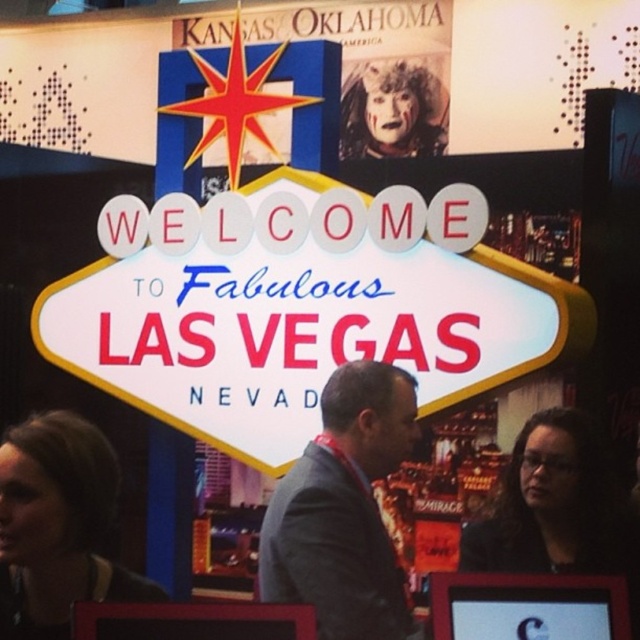
Which is behind, point (330, 531) or point (548, 540)?

The point (548, 540) is behind.

Does gray wool suit at center appear over black glossy hair at lower right?

No.

Measure the distance between point (284, 477) and camera.

The distance of point (284, 477) from camera is 37.63 meters.

Identify the location of gray wool suit at center. This screenshot has height=640, width=640. (342, 509).

In the scene shown: Is gray wool suit at center positioned before smooth black hair at lower left?

Yes.

Can you confirm if gray wool suit at center is positioned below smooth black hair at lower left?

Yes.

The image size is (640, 640). I want to click on gray wool suit at center, so click(342, 509).

Locate an element on the screen. The image size is (640, 640). gray wool suit at center is located at coordinates (342, 509).

Who is lower down, white plastic sign at center or gray wool suit at center?

gray wool suit at center is lower down.

Is white plastic sign at center smaller than gray wool suit at center?

Incorrect, white plastic sign at center is not smaller in size than gray wool suit at center.

Is point (56, 314) positioned in front of point (369, 419)?

No, it is behind (369, 419).

Locate an element on the screen. Image resolution: width=640 pixels, height=640 pixels. white plastic sign at center is located at coordinates (301, 332).